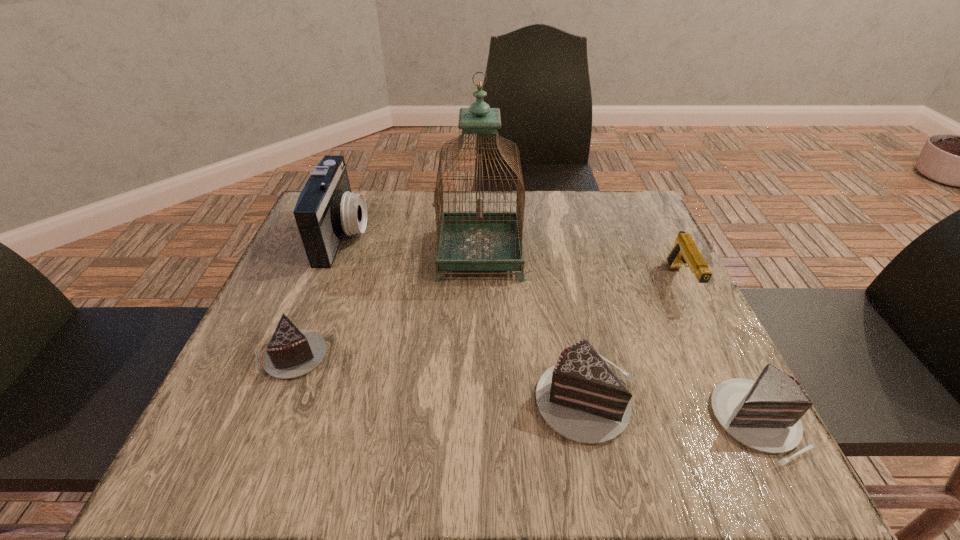
If we want them evenly spaced by inserting an extra chocolate_cake among them, please locate a free spot for this new chocolate_cake. Please provide its 2D coordinates. Your answer should be formatted as a tuple, i.e. [(x, y)], where the tuple contains the x and y coordinates of a point satisfying the conditions above.

[(433, 376)]